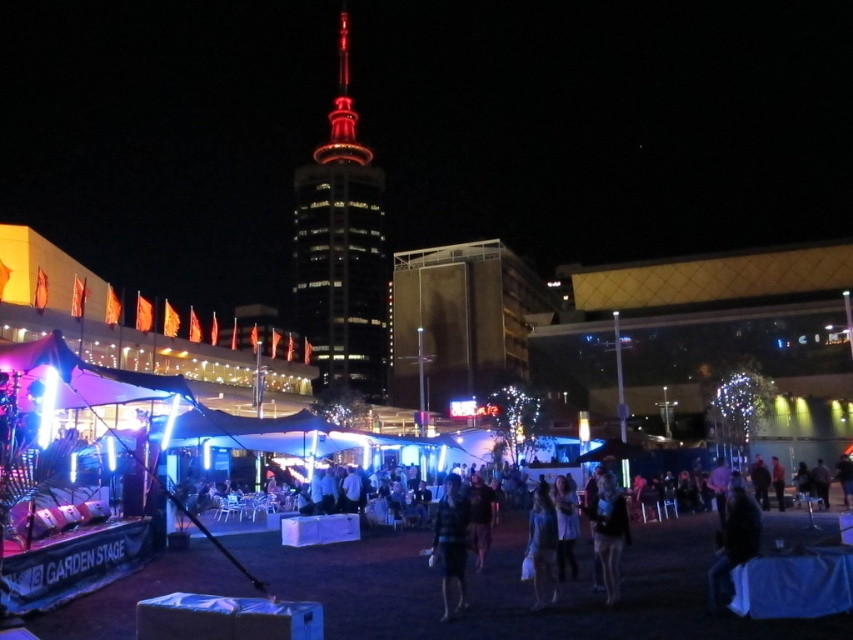
You are at the event and want to know which item is narrower between the striped fabric shirt at center and the dark blue fabric at center. Which one is narrower?

The striped fabric shirt at center is narrower than the dark blue fabric at center.

You are a photographer at the event and want to capture both the shiny glass tower at center and the striped fabric shirt at center in a single shot. Which object should you position to the left to include both in your frame?

The shiny glass tower at center is positioned on the left side of striped fabric shirt at center, so you should position the camera to the left of the striped fabric shirt at center to include both in the frame.

You are at the event and want to take a photo of the dark blue fabric at center without the striped fabric shirt at center blocking it. How should you adjust your position?

Move behind the dark blue fabric at center so that the striped fabric shirt at center is no longer in front of it.